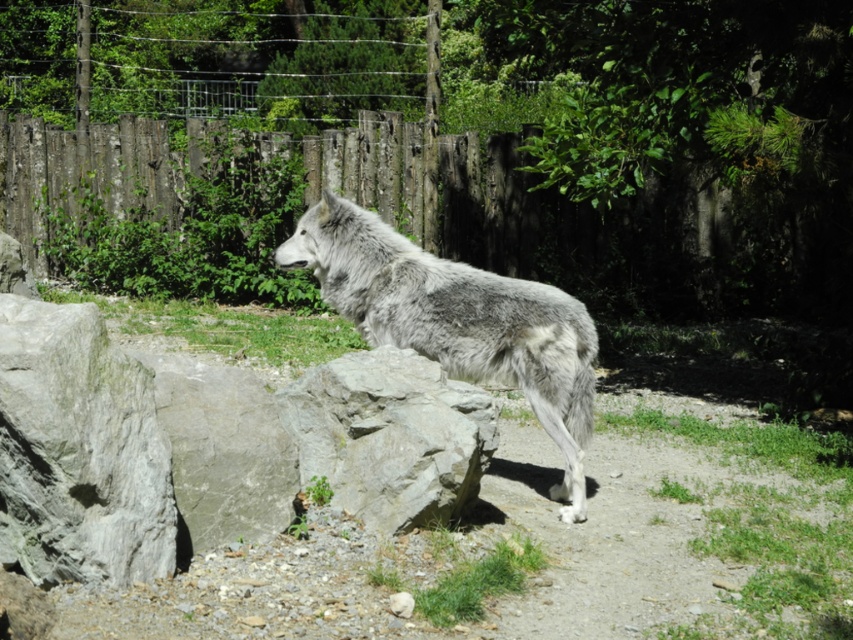
Question: Which of the following is the closest to the observer?

Choices:
 (A) (28, 364)
 (B) (322, 451)
 (C) (491, 337)

Answer: (A)

Question: Can you confirm if gray rough rock at lower left is smaller than gray fur wolf at center?

Choices:
 (A) yes
 (B) no

Answer: (A)

Question: Can you confirm if gray rough rock at lower left is wider than gray rough rock at center?

Choices:
 (A) yes
 (B) no

Answer: (B)

Question: Can you confirm if gray fur wolf at center is positioned above gray rough rock at center?

Choices:
 (A) no
 (B) yes

Answer: (B)

Question: Which of these objects is positioned closest to the gray fur wolf at center?

Choices:
 (A) gray rough rock at lower left
 (B) gray rough rock at center

Answer: (B)

Question: Estimate the real-world distances between objects in this image. Which object is farther from the gray fur wolf at center?

Choices:
 (A) gray rough rock at center
 (B) gray rough rock at lower left

Answer: (B)